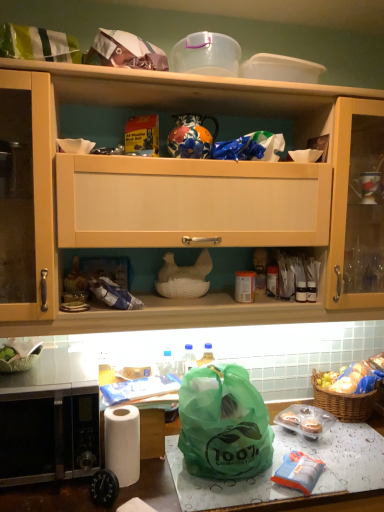
Describe the element at coordinates (206, 55) in the screenshot. This screenshot has width=384, height=512. I see `transparent plastic container at upper center` at that location.

Measure the distance between point (96, 436) and camera.

The depth of point (96, 436) is 4.47 feet.

Image resolution: width=384 pixels, height=512 pixels. I want to click on green plastic bag at lower center, so click(x=281, y=462).

You are a GUI agent. You are given a task and a screenshot of the screen. Output one action in this format:
    pyautogui.click(x=<x>, y=<y>)
    Task: Click on the brown woven picnic basket at lower right
    The width and height of the screenshot is (384, 512).
    Given the screenshot: What is the action you would take?
    pyautogui.click(x=343, y=402)

At what (x,y) coordinates should I click in order to perform the action: click on wooden cabinet at upper center. Please return your answer as a coordinate pair (x, y). This screenshot has width=384, height=512. Looking at the image, I should click on (185, 195).

This screenshot has width=384, height=512. What do you see at coordinates (185, 195) in the screenshot?
I see `wooden cabinet at upper center` at bounding box center [185, 195].

In order to click on transparent plastic container at upper center in this screenshot , I will do `click(206, 55)`.

Is brown woven picnic basket at lower right next to green plastic bag at lower right, which is counted as the third food, starting from the front?

Yes, brown woven picnic basket at lower right is right next to green plastic bag at lower right, which is counted as the third food, starting from the front, and making contact.

From a real-world perspective, who is located higher, brown woven picnic basket at lower right or green plastic bag at lower right, which is counted as the first food, starting from the top?

In real-world perspective, green plastic bag at lower right, which is counted as the first food, starting from the top, is above.

How distant is brown woven picnic basket at lower right from green plastic bag at lower right, which is counted as the first food, starting from the top?

A distance of 2.05 inches exists between brown woven picnic basket at lower right and green plastic bag at lower right, which is counted as the first food, starting from the top.

Between brown woven picnic basket at lower right and green plastic bag at lower right, which is the 1th food from back to front, which one appears on the left side from the viewer's perspective?

Positioned to the left is brown woven picnic basket at lower right.

Looking at this image, which is more to the left, white matte paper towel at lower left or translucent plastic cupcakes at lower right, the second food when ordered from back to front?

white matte paper towel at lower left is more to the left.

This screenshot has width=384, height=512. There is a translucent plastic cupcakes at lower right, the 2th food viewed from the front. What are the coordinates of `paper towel above it (from a real-world perspective)` in the screenshot? It's located at (122, 443).

Would you consider white matte paper towel at lower left to be distant from translucent plastic cupcakes at lower right, which is counted as the 2th food, starting from the bottom?

No.

Based on the photo, from the image's perspective, which object appears higher, white matte paper towel at lower left or translucent plastic cupcakes at lower right, the second food when ordered from back to front?

white matte paper towel at lower left.

How many degrees apart are the facing directions of green plastic bag at lower center and green plastic bag at lower center?

The angle between the facing direction of green plastic bag at lower center and the facing direction of green plastic bag at lower center is 2.1 degrees.

Is point (332, 466) farther from camera compared to point (195, 428)?

Yes, it is behind point (195, 428).

From a real-world perspective, is green plastic bag at lower center under green plastic bag at lower center?

Correct, in the physical world, green plastic bag at lower center is lower than green plastic bag at lower center.

Considering the positions of objects green plastic bag at lower center and green plastic bag at lower center in the image provided, who is more to the right, green plastic bag at lower center or green plastic bag at lower center?

Positioned to the right is green plastic bag at lower center.

Can you tell me how much green plastic bag at lower center and stainless steel microwave at lower left differ in facing direction?

They differ by 3.09 degrees in their facing directions.

Can you confirm if green plastic bag at lower center is wider than stainless steel microwave at lower left?

Incorrect, the width of green plastic bag at lower center does not surpass that of stainless steel microwave at lower left.

Can you see green plastic bag at lower center touching stainless steel microwave at lower left?

No, green plastic bag at lower center is not beside stainless steel microwave at lower left.

Identify the location of microwave oven above the green plastic bag at lower center (from the image's perspective). (48, 435).

Considering the sizes of objects matte plastic bag at lower center and wooden cabinet at upper center in the image provided, who is smaller, matte plastic bag at lower center or wooden cabinet at upper center?

wooden cabinet at upper center.

Consider the image. Does matte plastic bag at lower center have a lesser width compared to wooden cabinet at upper center?

No, matte plastic bag at lower center is not thinner than wooden cabinet at upper center.

Which point is more distant from viewer, (x=91, y=498) or (x=155, y=327)?

The point (x=155, y=327) is more distant.

From a real-world perspective, does matte plastic bag at lower center stand above wooden cabinet at upper center?

No, from a real-world perspective, matte plastic bag at lower center is not on top of wooden cabinet at upper center.

Is point (39, 291) positioned behind point (34, 460)?

That is True.

In terms of size, does wooden cabinet at upper center appear bigger or smaller than stainless steel microwave at lower left?

Clearly, wooden cabinet at upper center is larger in size than stainless steel microwave at lower left.

In the scene shown: Can you confirm if wooden cabinet at upper center is thinner than stainless steel microwave at lower left?

Indeed, wooden cabinet at upper center has a lesser width compared to stainless steel microwave at lower left.

Would you say wooden cabinet at upper center is inside or outside stainless steel microwave at lower left?

wooden cabinet at upper center is spatially situated outside stainless steel microwave at lower left.

How many degrees apart are the facing directions of green plastic bag at lower center and translucent plastic cupcakes at lower right, which is counted as the 2th food, starting from the bottom?

The angle between the facing direction of green plastic bag at lower center and the facing direction of translucent plastic cupcakes at lower right, which is counted as the 2th food, starting from the bottom, is 34.4 degrees.

Considering the sizes of green plastic bag at lower center and translucent plastic cupcakes at lower right, the second food when ordered from back to front, in the image, is green plastic bag at lower center wider or thinner than translucent plastic cupcakes at lower right, the second food when ordered from back to front,?

In the image, green plastic bag at lower center appears to be wider than translucent plastic cupcakes at lower right, the second food when ordered from back to front.

Consider the image. Are green plastic bag at lower center and translucent plastic cupcakes at lower right, the 2th food viewed from the front, located far from each other?

No, green plastic bag at lower center is in close proximity to translucent plastic cupcakes at lower right, the 2th food viewed from the front.

The image size is (384, 512). I want to click on picnic basket lying below the green plastic bag at lower right, acting as the 3th food starting from the bottom (from the image's perspective), so click(x=343, y=402).

From a real-world perspective, starting from the white matte paper towel at lower left, which food is the 1st one below it? Please provide its 2D coordinates.

[(305, 420)]

Considering their positions, is brown woven picnic basket at lower right positioned closer to translucent plastic cupcakes at lower right, the second food positioned from the top, than transparent plastic container at upper center?

Based on the image, brown woven picnic basket at lower right appears to be nearer to translucent plastic cupcakes at lower right, the second food positioned from the top.

Considering their positions, is matte plastic bag at lower center positioned further to green plastic bag at lower right, which is counted as the third food, starting from the front, than green plastic bag at lower center?

Among the two, matte plastic bag at lower center is located further to green plastic bag at lower right, which is counted as the third food, starting from the front.

Considering their positions, is matte plastic bag at lower center positioned further to white matte paper towel at lower left than green plastic bag at lower center?

The object further to white matte paper towel at lower left is green plastic bag at lower center.

Which object lies further to the anchor point green plastic bag at lower right, which is counted as the first food, starting from the top, stainless steel microwave at lower left or white matte paper towel at lower left?

Based on the image, stainless steel microwave at lower left appears to be further to green plastic bag at lower right, which is counted as the first food, starting from the top.

Based on their spatial positions, is green plastic bag at lower center or stainless steel microwave at lower left further from white matte paper towel at lower left?

Among the two, green plastic bag at lower center is located further to white matte paper towel at lower left.

From the image, which object appears to be nearer to green plastic bag at lower center, brown woven picnic basket at lower right or wooden cabinet at upper center?

Based on the image, wooden cabinet at upper center appears to be nearer to green plastic bag at lower center.

Based on their spatial positions, is transparent plastic container at upper center or matte plastic bag at lower center further from white matte paper towel at lower left?

Among the two, transparent plastic container at upper center is located further to white matte paper towel at lower left.

When comparing their distances from green plastic bag at lower center, does translucent plastic cupcakes at lower right, the 2th food viewed from the front, or stainless steel microwave at lower left seem further?

The object further to green plastic bag at lower center is stainless steel microwave at lower left.

This screenshot has width=384, height=512. Find the location of `paper towel between wooden cabinet at upper center and green plastic bag at lower center from top to bottom`. paper towel between wooden cabinet at upper center and green plastic bag at lower center from top to bottom is located at coordinates (122, 443).

Image resolution: width=384 pixels, height=512 pixels. I want to click on plastic bag positioned between green plastic bag at lower center and translucent plastic cupcakes at lower right, the second food when ordered from back to front, from near to far, so click(223, 424).

At what (x,y) coordinates should I click in order to perform the action: click on picnic basket between wooden cabinet at upper center and white matte paper towel at lower left vertically. Please return your answer as a coordinate pair (x, y). The image size is (384, 512). Looking at the image, I should click on (343, 402).

In order to click on food between stainless steel microwave at lower left and translucent plastic cupcakes at lower right, the second food when ordered from back to front in this screenshot , I will do `click(299, 472)`.